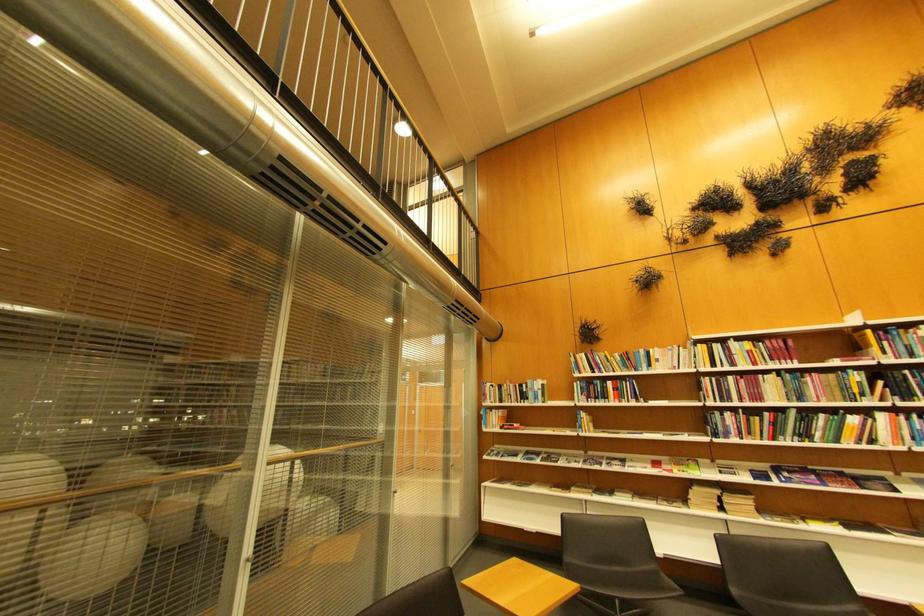
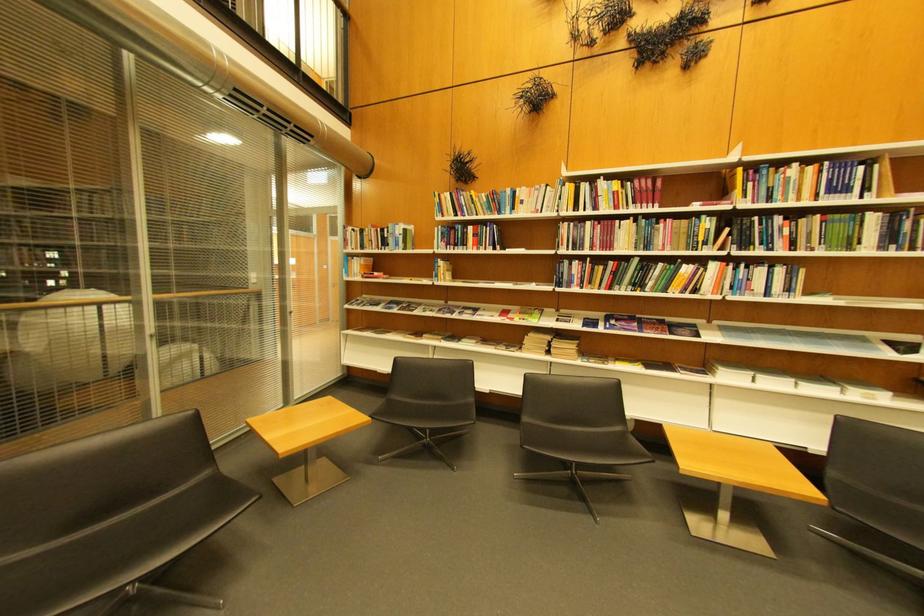
Where in the second image is the point corresponding to point 654,368 from the first image?

(518, 209)